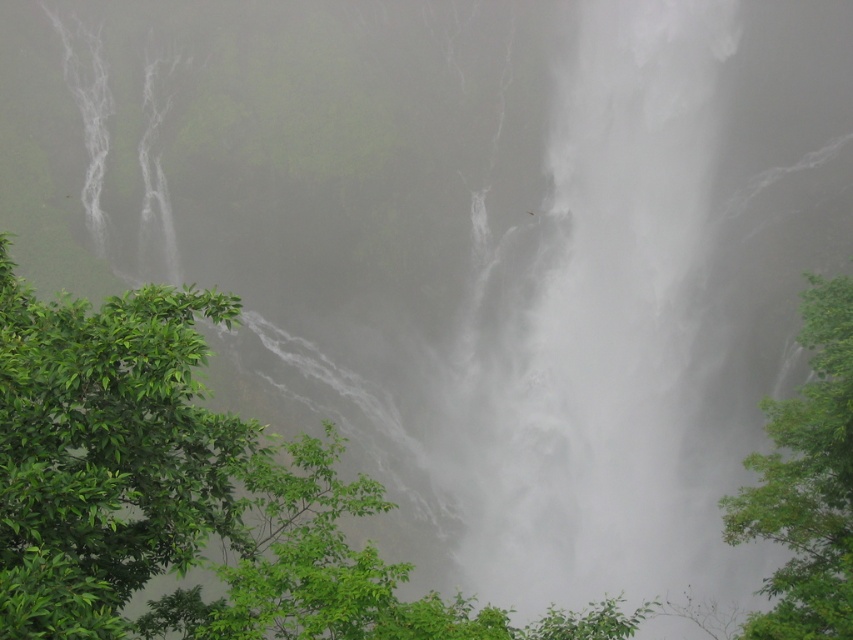
You are a bird flying over the waterfall scene. You want to land on the taller tree to rest. Which tree should you choose between the green leafy tree at left and the green leafy tree at right?

The green leafy tree at right is taller than the green leafy tree at left, so you should choose the green leafy tree at right to land and rest.

You are standing at the base of the waterfall and want to take a photo of both the green leafy tree at left and the green leafy tree at right. Since the mist is thick, you need to move closer to the trees to get a clear shot. Which tree should you move toward first to ensure both are in frame?

You should move toward the green leafy tree at left first because it is closer to you than the green leafy tree at right, which is further back. By moving closer to the nearer tree, you can still keep both trees within your camera frame while ensuring clarity due to their relative positions.